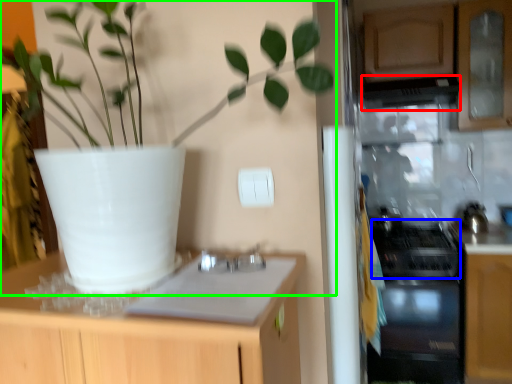
Question: Which object is the farthest from exhaust hood (highlighted by a red box)? Choose among these: gas stove (highlighted by a blue box) or houseplant (highlighted by a green box).

Choices:
 (A) gas stove
 (B) houseplant

Answer: (B)